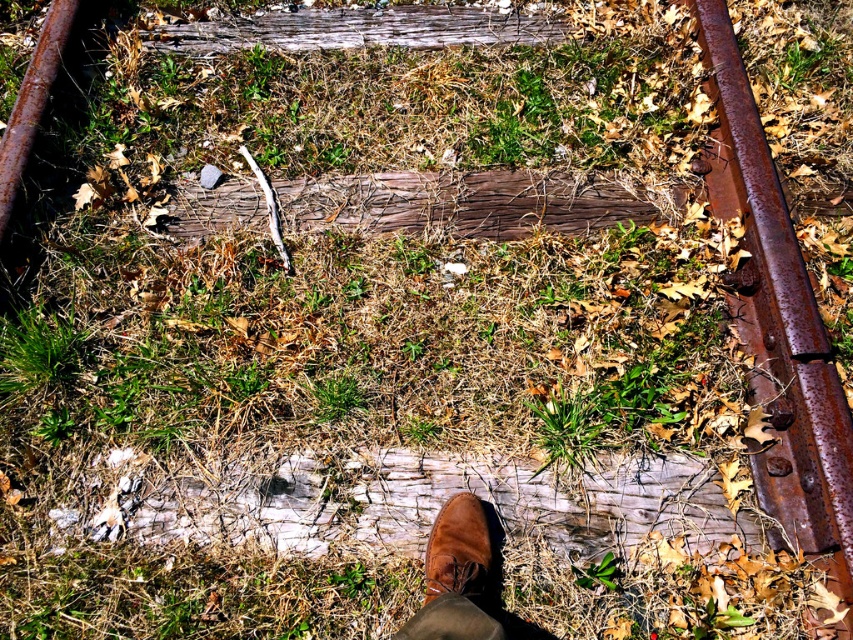
You are a maintenance worker checking the railway tracks. You notice the rusty metal train track at right and the brown suede shoe at center. Which object is higher in elevation?

The rusty metal train track at right is taller than the brown suede shoe at center.

You are a photographer trying to capture a closeup of the brown suede shoe at center without including the rusty metal train track at right in the frame. Given their sizes, do you think this is possible?

The rusty metal train track at right is bigger than the brown suede shoe at center, so it might be challenging to frame the shoe without including the track, especially if they are positioned closely together in the scene.